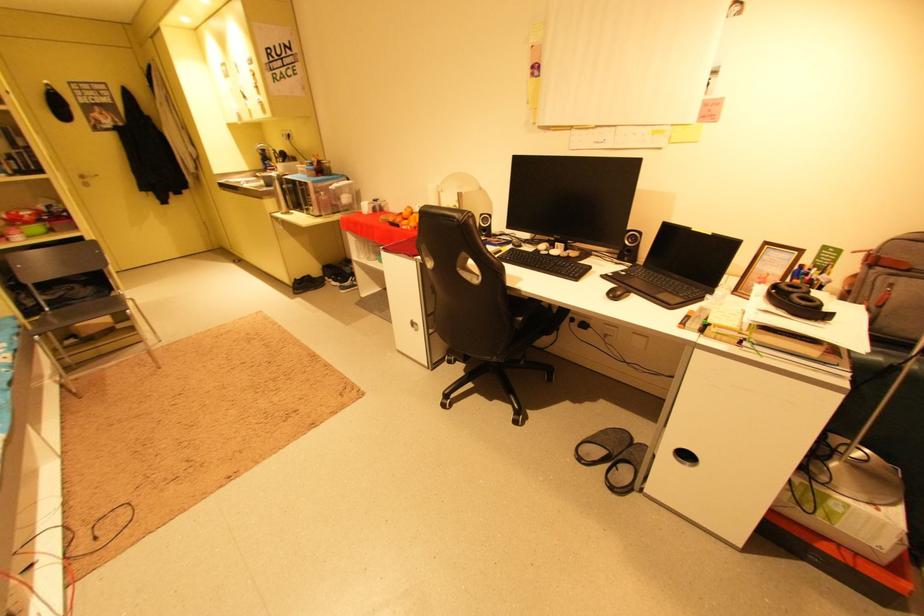
What are the coordinates of `backpack handle` in the screenshot? It's located at (892, 264).